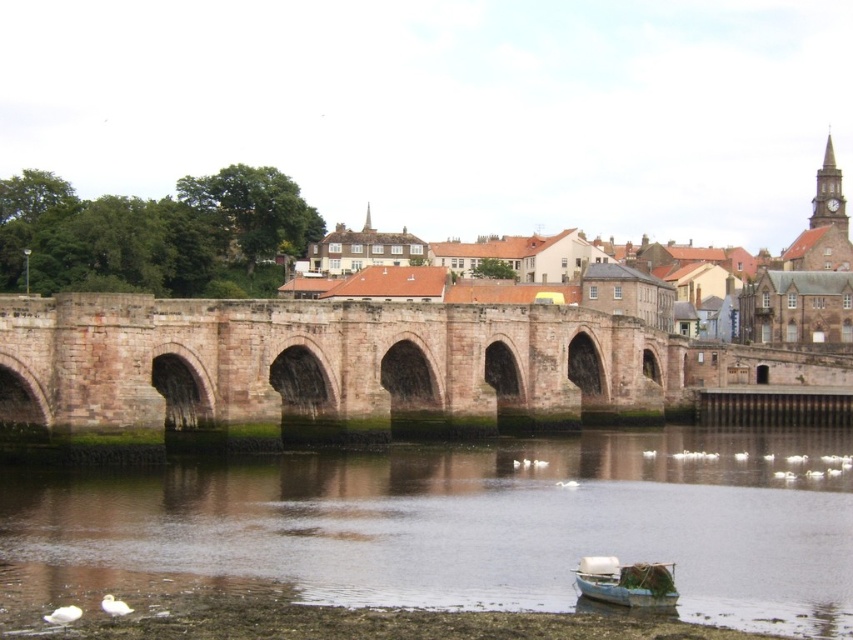
Question: Estimate the real-world distances between objects in this image. Which object is farther from the white wooden boat at lower center?

Choices:
 (A) brown stone river at lower center
 (B) rustic stone bridge at center

Answer: (B)

Question: Among these points, which one is farthest from the camera?

Choices:
 (A) (482, 333)
 (B) (822, 275)
 (C) (648, 602)
 (D) (113, 520)

Answer: (B)

Question: Can you confirm if brown stone bridge at center is positioned below white wooden boat at lower center?

Choices:
 (A) yes
 (B) no

Answer: (B)

Question: Considering the relative positions of brown stone river at lower center and brown stone bridge at center in the image provided, where is brown stone river at lower center located with respect to brown stone bridge at center?

Choices:
 (A) left
 (B) right

Answer: (A)

Question: Among these points, which one is farthest from the camera?

Choices:
 (A) pos(625,598)
 (B) pos(669,326)

Answer: (B)

Question: Does brown stone river at lower center appear on the left side of white wooden boat at lower center?

Choices:
 (A) yes
 (B) no

Answer: (B)